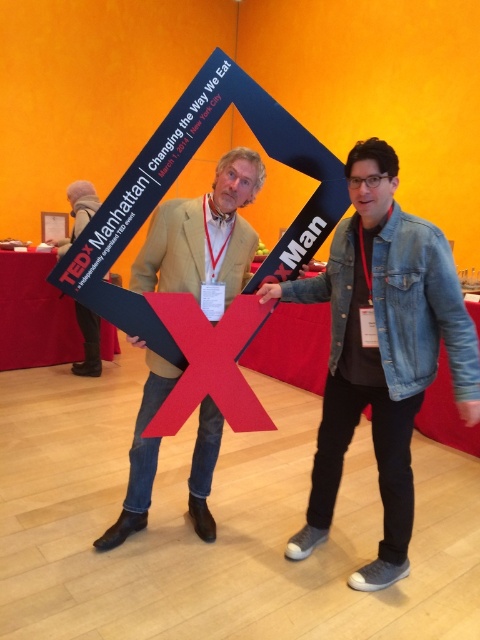
Question: Which object is the closest to the matte black sign at left?

Choices:
 (A) light brown leather jacket at center
 (B) denim jacket at lower right

Answer: (A)

Question: Does denim jacket at lower right come behind light brown leather jacket at center?

Choices:
 (A) yes
 (B) no

Answer: (B)

Question: Can you confirm if light brown leather jacket at center is positioned to the right of matte black sign at left?

Choices:
 (A) yes
 (B) no

Answer: (A)

Question: Based on their relative distances, which object is nearer to the matte black sign at left?

Choices:
 (A) denim jacket at lower right
 (B) light brown leather jacket at center

Answer: (B)

Question: Is denim jacket at lower right below matte black sign at left?

Choices:
 (A) yes
 (B) no

Answer: (A)

Question: Which object is positioned farthest from the light brown leather jacket at center?

Choices:
 (A) matte black sign at left
 (B) denim jacket at lower right

Answer: (A)